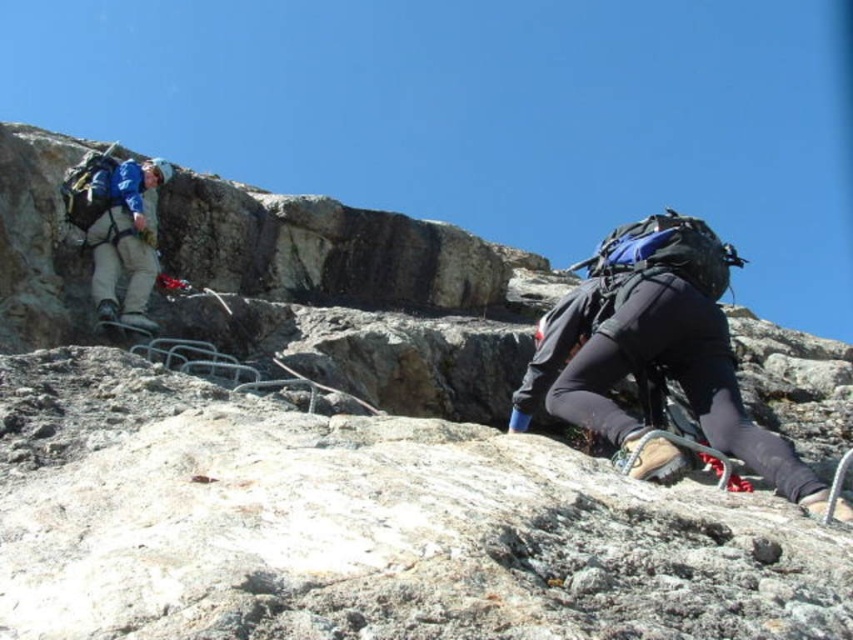
From the picture: You are a hiker planning to climb the same rock face. You see the matte black backpack at lower right and the blue fabric jacket at upper left. Which object is closer to the bottom of the rock face?

The matte black backpack at lower right is closer to the bottom of the rock face because it is positioned under the blue fabric jacket at upper left.

You are a hiker planning to climb the same rock face. You see the matte black backpack at lower right and the blue fabric jacket at upper left. Which object is closer to you?

The matte black backpack at lower right is closer to you because it is in front of the blue fabric jacket at upper left.

You are a drone operator trying to capture a photo of both climbers. You notice two points marked as point1 and point2. If point1 is at coordinate (717, 339) and point2 is at (157, 269), which point is closer to your camera lens?

Point1 is closer to the camera lens because the Objects Description states that point1 is closer to the camera than point2.